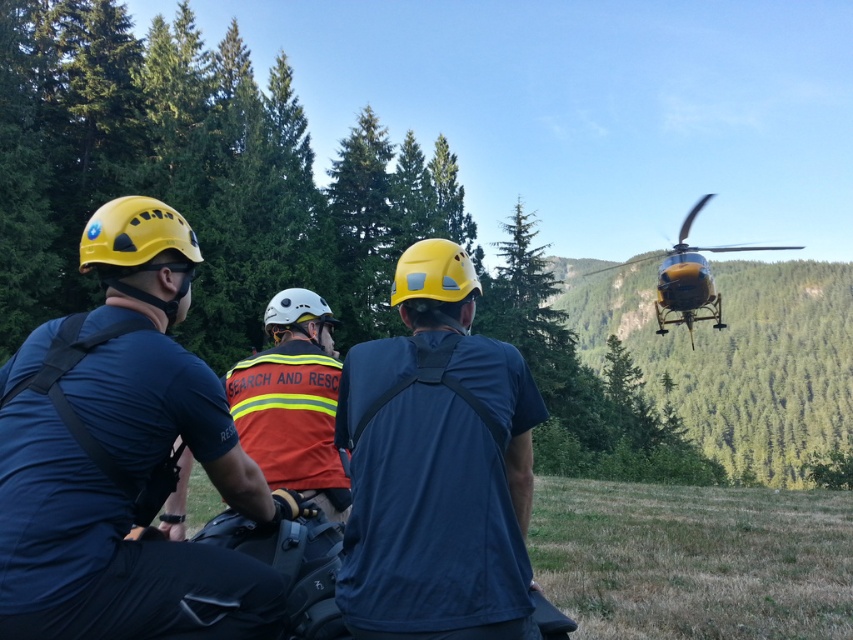
Question: Considering the relative positions of orange reflective safety vest at center and yellow metallic helicopter at upper right in the image provided, where is orange reflective safety vest at center located with respect to yellow metallic helicopter at upper right?

Choices:
 (A) below
 (B) above

Answer: (A)

Question: Does matte yellow helmet at left have a greater width compared to matte yellow helmet at center?

Choices:
 (A) yes
 (B) no

Answer: (A)

Question: Is matte yellow helmet at center in front of orange reflective safety vest at center?

Choices:
 (A) yes
 (B) no

Answer: (A)

Question: Which point is farther to the camera?

Choices:
 (A) (97, 531)
 (B) (457, 600)
 (C) (287, 452)

Answer: (C)

Question: Which object is the farthest from the orange reflective safety vest at center?

Choices:
 (A) matte yellow helmet at left
 (B) matte yellow helmet at center
 (C) yellow metallic helicopter at upper right

Answer: (C)

Question: Which of the following is the farthest from the observer?

Choices:
 (A) (688, 218)
 (B) (347, 492)
 (C) (97, 500)
 (D) (428, 369)

Answer: (A)